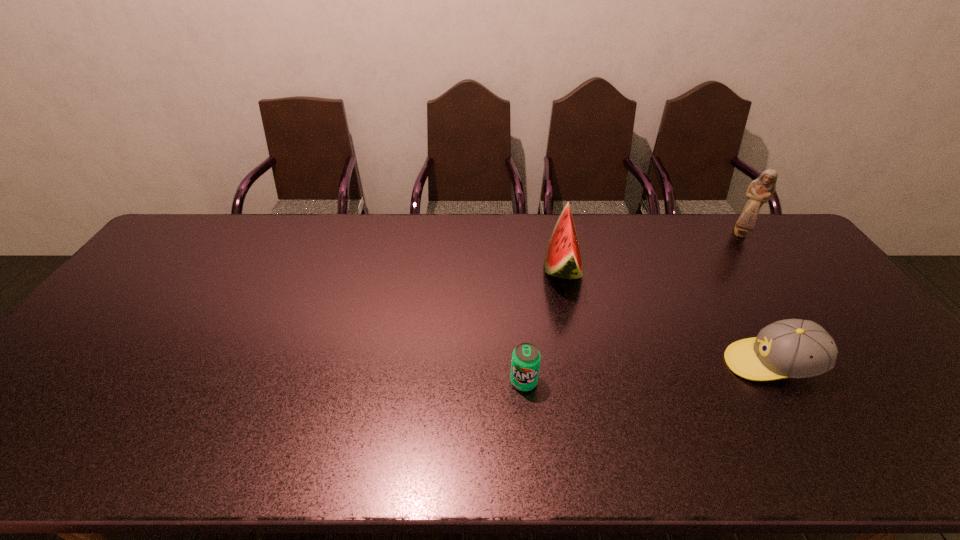
You are a GUI agent. You are given a task and a screenshot of the screen. Output one action in this format:
    pyautogui.click(x=<x>, y=<y>)
    Task: Click on the empty location between the pop soda and the watermelon
    
    Given the screenshot: What is the action you would take?
    pyautogui.click(x=543, y=324)

Find the location of a particular element. The width and height of the screenshot is (960, 540). unoccupied area between the baseball cap and the figurine is located at coordinates (756, 299).

Identify the location of blank region between the tallest object and the baseball cap. (756, 299).

Locate an element on the screen. object that ranks as the second closest to the pop soda is located at coordinates (792, 348).

Locate which object is the third closest to the pop soda. Please provide its 2D coordinates. Your answer should be formatted as a tuple, i.e. [(x, y)], where the tuple contains the x and y coordinates of a point satisfying the conditions above.

[(760, 191)]

At what (x,y) coordinates should I click in order to perform the action: click on free space that satisfies the following two spatial constraints: 1. on the front-facing side of the tallest object; 2. on the outer rind of the watermelon. Please return your answer as a coordinate pair (x, y). This screenshot has width=960, height=540. Looking at the image, I should click on (764, 266).

Find the location of a particular element. The image size is (960, 540). vacant area in the image that satisfies the following two spatial constraints: 1. on the outer rind of the third shortest object; 2. on the front-facing side of the pop soda is located at coordinates pyautogui.click(x=588, y=382).

Locate an element on the screen. vacant position in the image that satisfies the following two spatial constraints: 1. on the outer rind of the third shortest object; 2. on the front-facing side of the pop soda is located at coordinates (588, 382).

The width and height of the screenshot is (960, 540). In order to click on vacant space that satisfies the following two spatial constraints: 1. on the front-facing side of the second object from right to left; 2. on the front-facing side of the leftmost object in this screenshot , I will do `click(782, 382)`.

Where is `vacant area in the image that satisfies the following two spatial constraints: 1. on the front-facing side of the second object from right to left; 2. on the front-facing side of the leftmost object`? vacant area in the image that satisfies the following two spatial constraints: 1. on the front-facing side of the second object from right to left; 2. on the front-facing side of the leftmost object is located at coordinates (782, 382).